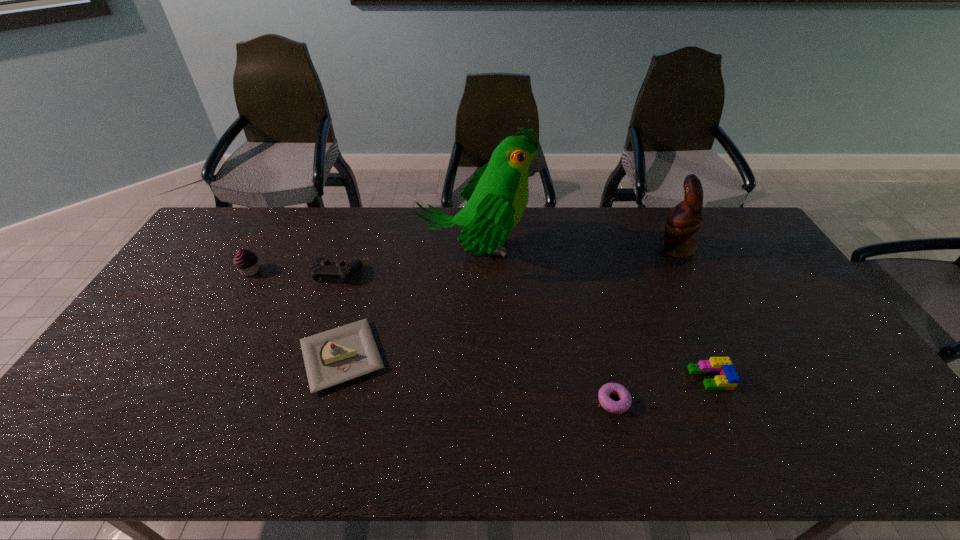
Image resolution: width=960 pixels, height=540 pixels. I want to click on parakeet, so click(x=497, y=196).

Locate an element on the screen. The width and height of the screenshot is (960, 540). the fourth object from left to right is located at coordinates coord(497,196).

The width and height of the screenshot is (960, 540). I want to click on the second tallest object, so click(x=685, y=219).

The height and width of the screenshot is (540, 960). Find the location of `cupcake`. cupcake is located at coordinates (246, 261).

Locate an element on the screen. the third tallest object is located at coordinates (246, 261).

I want to click on control, so click(320, 267).

Find the location of a particular element. Image resolution: width=960 pixels, height=540 pixels. cake is located at coordinates (338, 355).

Locate an element on the screen. the second shortest object is located at coordinates (727, 379).

I want to click on doughnut, so click(x=617, y=407).

The height and width of the screenshot is (540, 960). Identify the location of the shortest object. (617, 407).